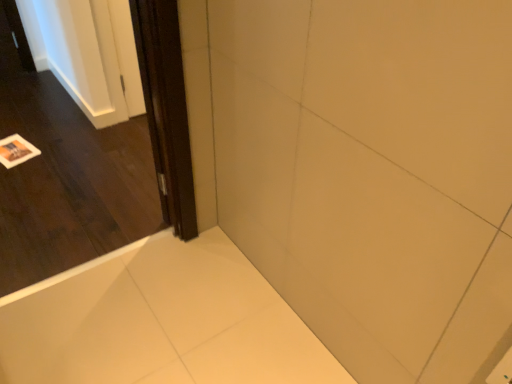
Locate an element on the screen. free point to the right of dark wood door at left is located at coordinates (187, 291).